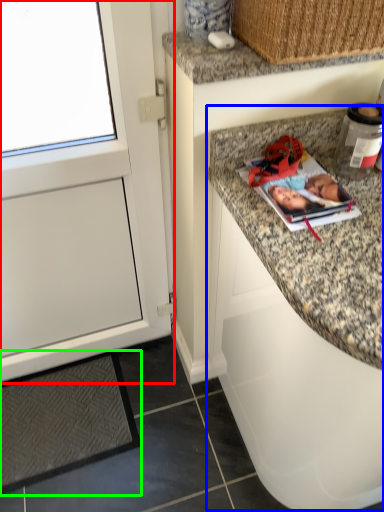
Question: Which object is the farthest from cabinetry (highlighted by a red box)? Choose among these: cabinetry (highlighted by a blue box) or mat (highlighted by a green box).

Choices:
 (A) cabinetry
 (B) mat

Answer: (A)